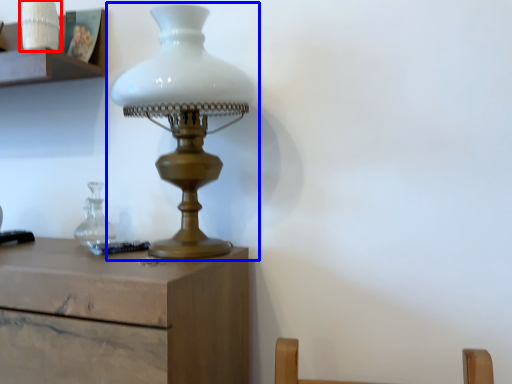
Question: Which object appears farthest to the camera in this image, candle holder (highlighted by a red box) or lamp (highlighted by a blue box)?

Choices:
 (A) candle holder
 (B) lamp

Answer: (A)